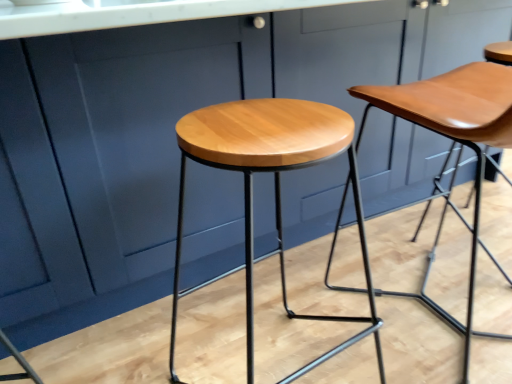
Question: Is the depth of light brown wood stool at center, which is the first stool from left to right, less than that of matte wood stool at center, the first stool viewed from the right?

Choices:
 (A) yes
 (B) no

Answer: (A)

Question: Is matte wood stool at center, which is counted as the 2th stool, starting from the left, inside light brown wood stool at center, which is the first stool from left to right?

Choices:
 (A) yes
 (B) no

Answer: (B)

Question: Could you tell me if light brown wood stool at center, which is counted as the second stool, starting from the right, is turned towards matte wood stool at center, the first stool viewed from the right?

Choices:
 (A) no
 (B) yes

Answer: (A)

Question: Can you confirm if light brown wood stool at center, which is counted as the second stool, starting from the right, is thinner than matte wood stool at center, the first stool viewed from the right?

Choices:
 (A) no
 (B) yes

Answer: (B)

Question: From a real-world perspective, is light brown wood stool at center, which is the first stool from left to right, below matte wood stool at center, the first stool viewed from the right?

Choices:
 (A) yes
 (B) no

Answer: (A)

Question: Does light brown wood stool at center, which is counted as the second stool, starting from the right, touch matte wood stool at center, the first stool viewed from the right?

Choices:
 (A) no
 (B) yes

Answer: (A)

Question: Considering the relative positions of matte wood stool at center, the first stool viewed from the right, and light brown wood stool at center, which is the first stool from left to right, in the image provided, is matte wood stool at center, the first stool viewed from the right, behind light brown wood stool at center, which is the first stool from left to right,?

Choices:
 (A) no
 (B) yes

Answer: (B)

Question: Is the surface of matte wood stool at center, which is counted as the 2th stool, starting from the left, in direct contact with light brown wood stool at center, which is counted as the second stool, starting from the right?

Choices:
 (A) yes
 (B) no

Answer: (B)

Question: Is matte wood stool at center, the first stool viewed from the right, to the right of light brown wood stool at center, which is the first stool from left to right, from the viewer's perspective?

Choices:
 (A) yes
 (B) no

Answer: (A)

Question: Does matte wood stool at center, which is counted as the 2th stool, starting from the left, have a greater width compared to light brown wood stool at center, which is counted as the second stool, starting from the right?

Choices:
 (A) yes
 (B) no

Answer: (A)

Question: Is matte wood stool at center, the first stool viewed from the right, facing towards light brown wood stool at center, which is counted as the second stool, starting from the right?

Choices:
 (A) no
 (B) yes

Answer: (A)

Question: Considering the relative sizes of matte wood stool at center, which is counted as the 2th stool, starting from the left, and light brown wood stool at center, which is the first stool from left to right, in the image provided, is matte wood stool at center, which is counted as the 2th stool, starting from the left, smaller than light brown wood stool at center, which is the first stool from left to right,?

Choices:
 (A) no
 (B) yes

Answer: (A)

Question: From a real-world perspective, is light brown wood stool at center, which is counted as the second stool, starting from the right, above or below matte wood stool at center, which is counted as the 2th stool, starting from the left?

Choices:
 (A) below
 (B) above

Answer: (A)